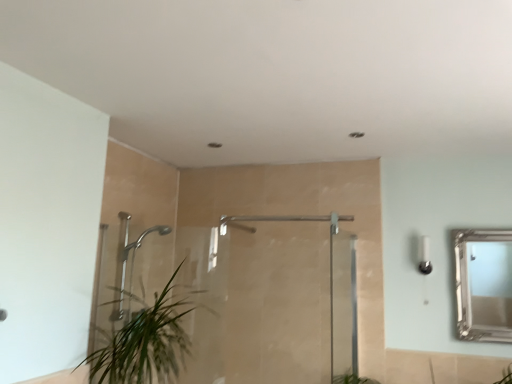
Question: Is clear glass door at center, which appears as the 1th screen door when viewed from the right, bigger or smaller than green leafy plant at lower left?

Choices:
 (A) big
 (B) small

Answer: (B)

Question: Considering the positions of clear glass door at center, which appears as the 1th screen door when viewed from the right, and green leafy plant at lower left in the image, is clear glass door at center, which appears as the 1th screen door when viewed from the right, taller or shorter than green leafy plant at lower left?

Choices:
 (A) short
 (B) tall

Answer: (B)

Question: Which object is the closest to the clear glass door at center, which appears as the 1th screen door when viewed from the right?

Choices:
 (A) green leafy plant at lower left
 (B) satin nickel shower at center, acting as the 1th shower starting from the right
 (C) polished chrome shower head at left, the 1th shower in the left-to-right sequence
 (D) silver/glass mirror at upper right
 (E) clear glass shower door at left, the first screen door positioned from the left

Answer: (E)

Question: Which is nearer to the green leafy plant at lower left?

Choices:
 (A) satin nickel shower at center, the second shower positioned from the left
 (B) clear glass shower door at left, the 2th screen door when ordered from right to left
 (C) silver/glass mirror at upper right
 (D) polished chrome shower head at left, placed as the second shower when sorted from right to left
 (E) clear glass door at center, which appears as the 1th screen door when viewed from the right

Answer: (D)